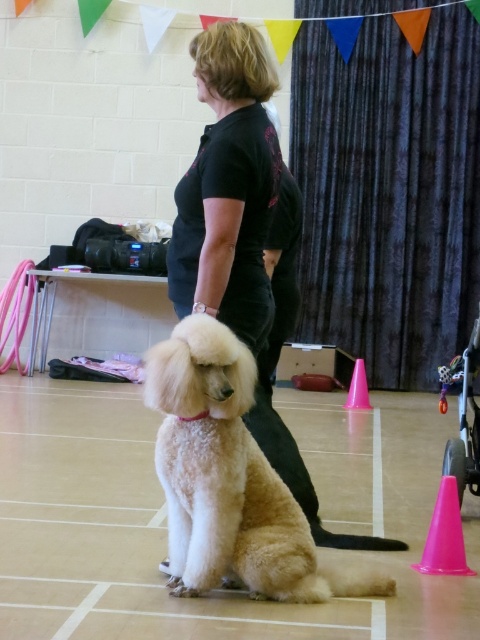
Question: Can you confirm if light beige fur at center is positioned above pink plastic cone at center-right?

Choices:
 (A) no
 (B) yes

Answer: (A)

Question: Which point is farther to the camera?

Choices:
 (A) metallic silver baby carriage at lower right
 (B) pink plastic cone at center-right
 (C) black smooth shirt at center
 (D) light beige fur at center

Answer: (B)

Question: Which object appears closest to the camera in this image?

Choices:
 (A) light beige fur at center
 (B) pink plastic cone at center-right
 (C) black smooth shirt at center

Answer: (A)

Question: Which object is farther from the camera taking this photo?

Choices:
 (A) pink plastic cone at center-right
 (B) metallic silver baby carriage at lower right
 (C) light beige fur at center
 (D) black smooth shirt at center

Answer: (A)

Question: Can you confirm if pink plastic cone at lower right is positioned below pink plastic cone at center-right?

Choices:
 (A) yes
 (B) no

Answer: (A)

Question: Does metallic silver baby carriage at lower right have a smaller size compared to pink plastic cone at lower right?

Choices:
 (A) no
 (B) yes

Answer: (A)